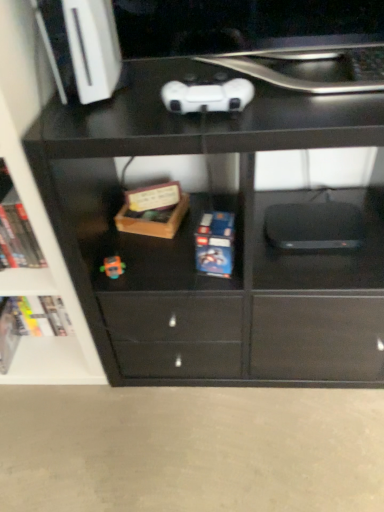
Question: Is hardcover book at lower left, the second book from the top, looking in the opposite direction of wooden box at center?

Choices:
 (A) yes
 (B) no

Answer: (B)

Question: Considering the relative positions of hardcover book at lower left, positioned as the 1th book in bottom-to-top order, and wooden box at center in the image provided, is hardcover book at lower left, positioned as the 1th book in bottom-to-top order, to the left of wooden box at center from the viewer's perspective?

Choices:
 (A) no
 (B) yes

Answer: (B)

Question: Is hardcover book at lower left, which is the first book from back to front, closer to the viewer compared to wooden box at center?

Choices:
 (A) no
 (B) yes

Answer: (A)

Question: Would you say hardcover book at lower left, the second book from the top, is outside wooden box at center?

Choices:
 (A) yes
 (B) no

Answer: (A)

Question: Are hardcover book at lower left, the second book from the top, and wooden box at center making contact?

Choices:
 (A) yes
 (B) no

Answer: (B)

Question: Is point click(51, 295) closer or farther from the camera than point click(347, 110)?

Choices:
 (A) farther
 (B) closer

Answer: (A)

Question: From the image's perspective, relative to black matte chest of drawers at center, is hardcover book at lower left, which is the first book from back to front, above or below?

Choices:
 (A) below
 (B) above

Answer: (A)

Question: Considering their positions, is hardcover book at lower left, the second book from the top, located in front of or behind black matte chest of drawers at center?

Choices:
 (A) behind
 (B) front

Answer: (A)

Question: From a real-world perspective, is hardcover book at lower left, the second book from the top, positioned above or below black matte chest of drawers at center?

Choices:
 (A) above
 (B) below

Answer: (B)

Question: Is black matte laptop keyboard at upper center inside or outside of hardcover book at left, the 1th book in the front-to-back sequence?

Choices:
 (A) inside
 (B) outside

Answer: (B)

Question: Considering the positions of black matte laptop keyboard at upper center and hardcover book at left, the 1th book in the front-to-back sequence, in the image, is black matte laptop keyboard at upper center taller or shorter than hardcover book at left, the 1th book in the front-to-back sequence,?

Choices:
 (A) short
 (B) tall

Answer: (A)

Question: Considering the relative positions of black matte laptop keyboard at upper center and hardcover book at left, which is the second book from bottom to top, in the image provided, is black matte laptop keyboard at upper center to the left or to the right of hardcover book at left, which is the second book from bottom to top,?

Choices:
 (A) right
 (B) left

Answer: (A)

Question: Looking at the image, does black matte laptop keyboard at upper center seem bigger or smaller compared to hardcover book at left, placed as the second book when sorted from back to front?

Choices:
 (A) big
 (B) small

Answer: (B)

Question: Is point (130, 212) closer or farther from the camera than point (377, 56)?

Choices:
 (A) closer
 (B) farther

Answer: (B)

Question: Is wooden box at center situated inside black matte laptop keyboard at upper center or outside?

Choices:
 (A) outside
 (B) inside

Answer: (A)